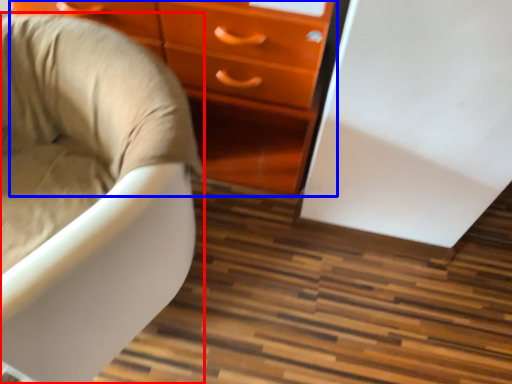
Question: Which object is further to the camera taking this photo, chair (highlighted by a red box) or chest of drawers (highlighted by a blue box)?

Choices:
 (A) chair
 (B) chest of drawers

Answer: (B)